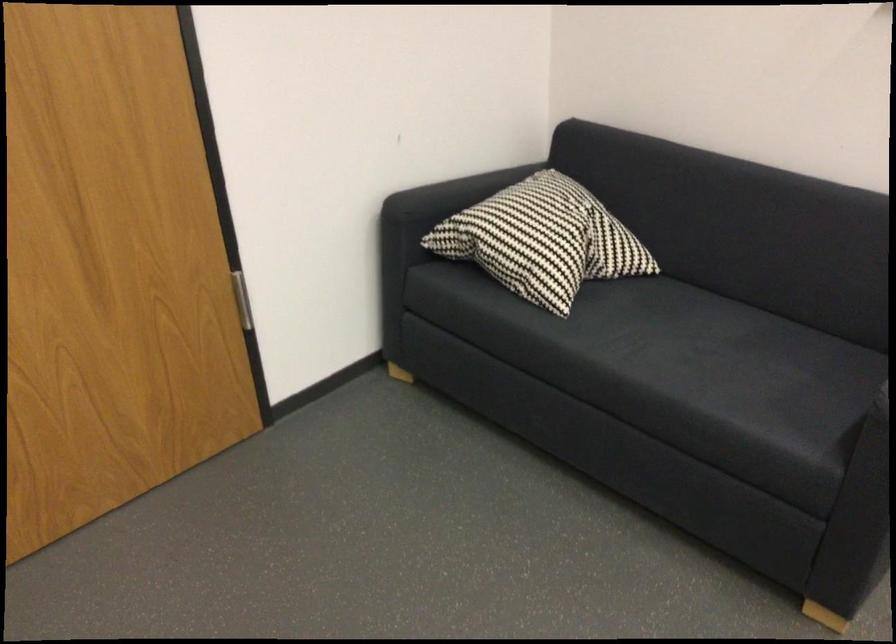
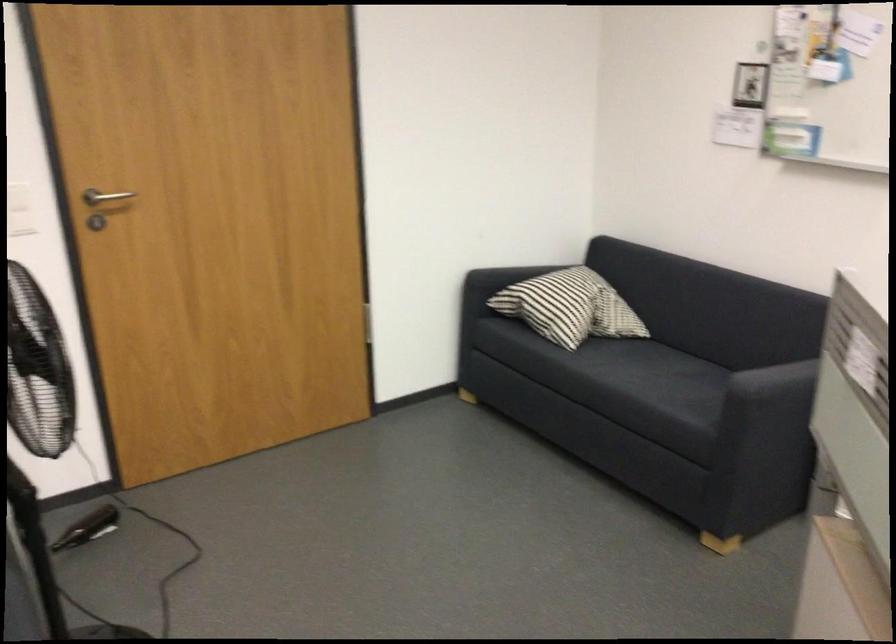
Question: The images are taken continuously from a first-person perspective. In which direction are you moving?

Choices:
 (A) Left
 (B) Right
 (C) Forward
 (D) Backward

Answer: (D)